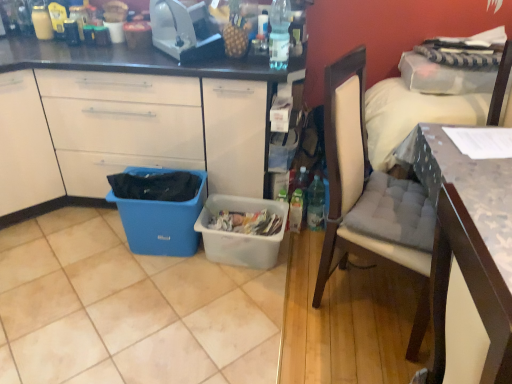
You are a GUI agent. You are given a task and a screenshot of the screen. Output one action in this format:
    pyautogui.click(x=<x>, y=<y>)
    Task: Click on the vacant space positioned to the left of blue plastic trash can at lower left
    This screenshot has height=384, width=512.
    Given the screenshot: What is the action you would take?
    pyautogui.click(x=92, y=249)